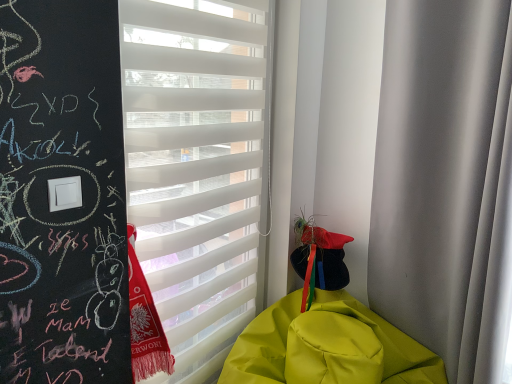
Question: Is white matte window blind at center oriented towards white matte curtain at right?

Choices:
 (A) yes
 (B) no

Answer: (A)

Question: Is white matte window blind at center bigger than white matte curtain at right?

Choices:
 (A) yes
 (B) no

Answer: (B)

Question: Considering the relative sizes of white matte window blind at center and white matte curtain at right in the image provided, is white matte window blind at center taller than white matte curtain at right?

Choices:
 (A) yes
 (B) no

Answer: (A)

Question: From the image's perspective, is white matte window blind at center located beneath white matte curtain at right?

Choices:
 (A) no
 (B) yes

Answer: (A)

Question: Is white matte window blind at center not within white matte curtain at right?

Choices:
 (A) no
 (B) yes

Answer: (B)

Question: Is white matte window blind at center oriented away from white matte curtain at right?

Choices:
 (A) yes
 (B) no

Answer: (B)

Question: Considering the relative sizes of white matte window blind at center and yellow matte blanket at lower right in the image provided, is white matte window blind at center wider than yellow matte blanket at lower right?

Choices:
 (A) no
 (B) yes

Answer: (A)

Question: Is white matte window blind at center looking in the opposite direction of yellow matte blanket at lower right?

Choices:
 (A) yes
 (B) no

Answer: (B)

Question: Is white matte window blind at center thinner than yellow matte blanket at lower right?

Choices:
 (A) no
 (B) yes

Answer: (B)

Question: Can you confirm if white matte window blind at center is bigger than yellow matte blanket at lower right?

Choices:
 (A) yes
 (B) no

Answer: (B)

Question: Can you confirm if white matte window blind at center is positioned to the right of yellow matte blanket at lower right?

Choices:
 (A) yes
 (B) no

Answer: (B)

Question: Does white matte window blind at center have a smaller size compared to yellow matte blanket at lower right?

Choices:
 (A) no
 (B) yes

Answer: (B)

Question: From a real-world perspective, is white matte curtain at right physically above white matte window blind at center?

Choices:
 (A) yes
 (B) no

Answer: (A)